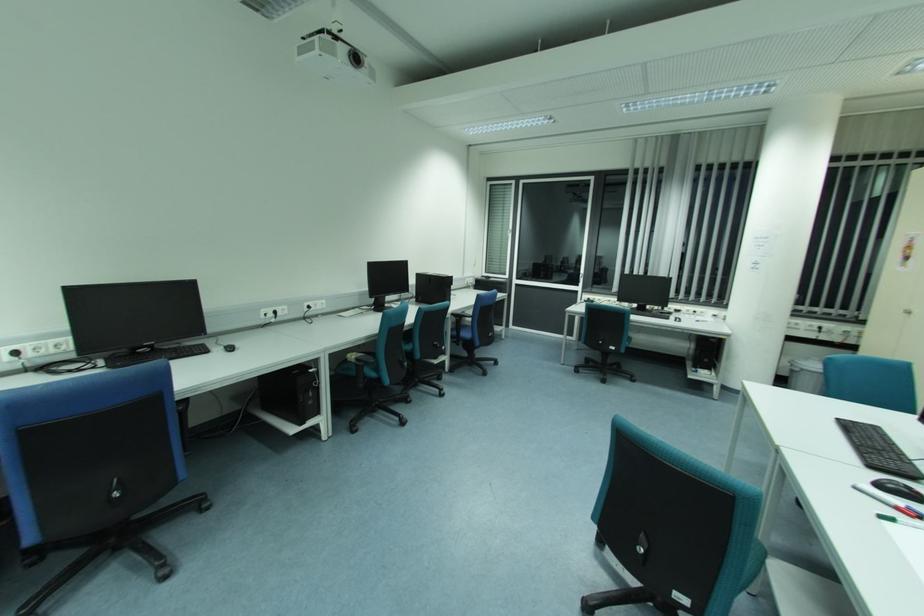
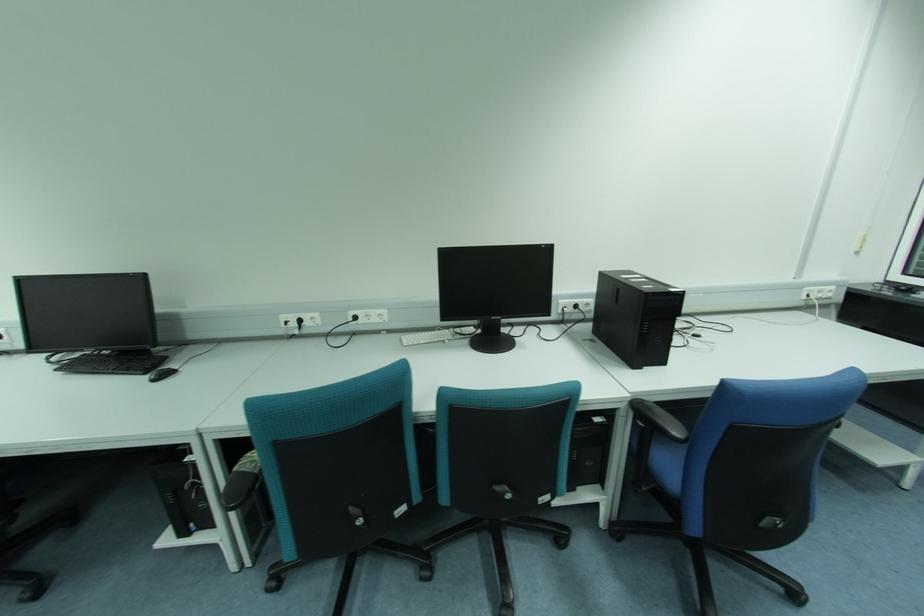
Locate, in the second image, the point that corresponds to the point at 286,312 in the first image.

(319, 322)